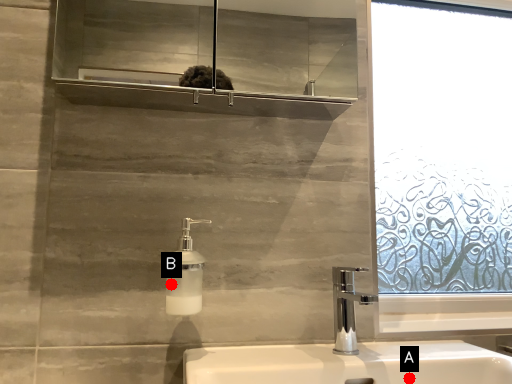
Question: Two points are circled on the image, labeled by A and B beside each circle. Which point is closer to the camera taking this photo?

Choices:
 (A) A is closer
 (B) B is closer

Answer: (B)